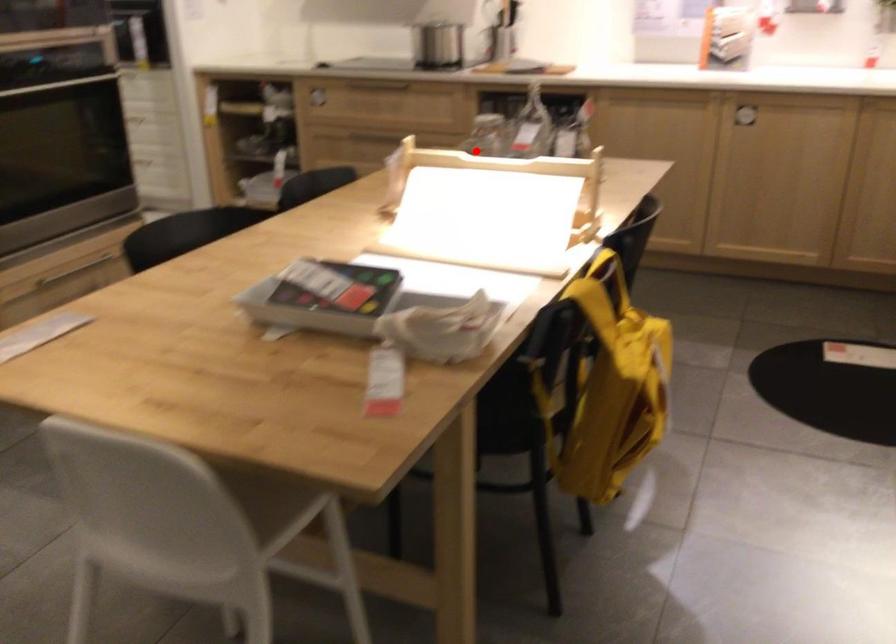
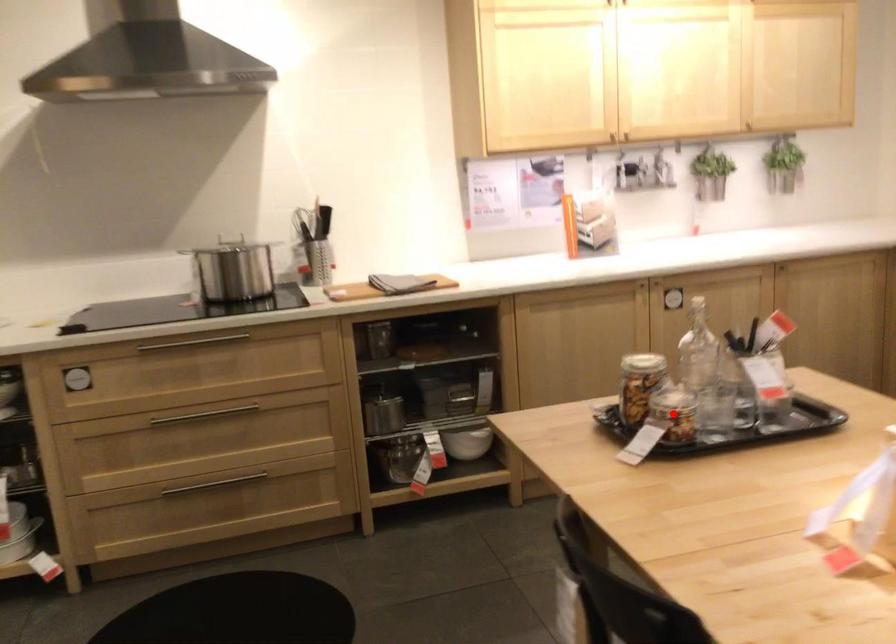
I am providing you with two images of the same scene from different viewpoints. A red point is marked on the first image and another point is marked on the second image. Are the points marked in image1 and image2 representing the same 3D position?

Yes